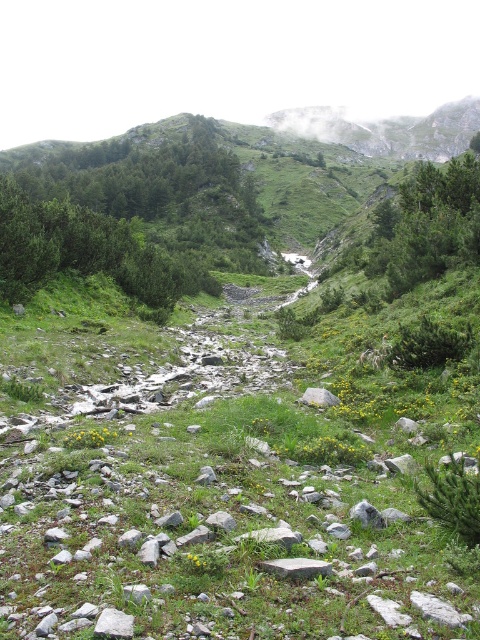
Does green leafy shrubs at upper left appear on the right side of gray rock at center?

No, green leafy shrubs at upper left is not to the right of gray rock at center.

Is green leafy shrubs at upper left in front of gray rock at center?

No, it is not.

Does point (212, 193) come farther from viewer compared to point (309, 390)?

Yes, it is.

Identify the location of green leafy shrubs at upper left. (132, 218).

Does gray granite rock at center come behind gray rock at center?

No, gray granite rock at center is in front of gray rock at center.

Between point (323, 563) and point (324, 403), which one is positioned in front?

Point (323, 563)

The width and height of the screenshot is (480, 640). What do you see at coordinates (297, 566) in the screenshot? I see `gray granite rock at center` at bounding box center [297, 566].

Locate an element on the screen. gray granite rock at center is located at coordinates (297, 566).

Between gray granite rock at center and gray rock at lower left, which one appears on the right side from the viewer's perspective?

gray granite rock at center

In the scene shown: Can you confirm if gray granite rock at center is bigger than gray rock at lower left?

→ Correct, gray granite rock at center is larger in size than gray rock at lower left.

Which is behind, point (275, 560) or point (108, 634)?

The point (275, 560) is behind.

This screenshot has height=640, width=480. I want to click on gray granite rock at center, so click(297, 566).